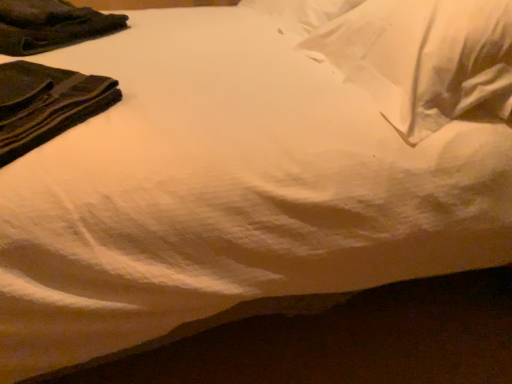
Question: Is point (355, 72) positioned closer to the camera than point (75, 8)?

Choices:
 (A) closer
 (B) farther

Answer: (A)

Question: Considering the positions of white soft pillow at upper right and dark green fabric at upper left, the first clothing from the back, in the image, is white soft pillow at upper right taller or shorter than dark green fabric at upper left, the first clothing from the back,?

Choices:
 (A) short
 (B) tall

Answer: (B)

Question: Estimate the real-world distances between objects in this image. Which object is farther from the white soft pillow at upper right?

Choices:
 (A) dark green fabric at upper left, positioned as the first clothing in front-to-back order
 (B) dark green fabric at upper left, the 1th clothing in the top-to-bottom sequence

Answer: (B)

Question: Which of these objects is positioned farthest from the dark green fabric at upper left, positioned as the 2th clothing in top-to-bottom order?

Choices:
 (A) dark green fabric at upper left, the 1th clothing in the top-to-bottom sequence
 (B) white soft pillow at upper right

Answer: (B)